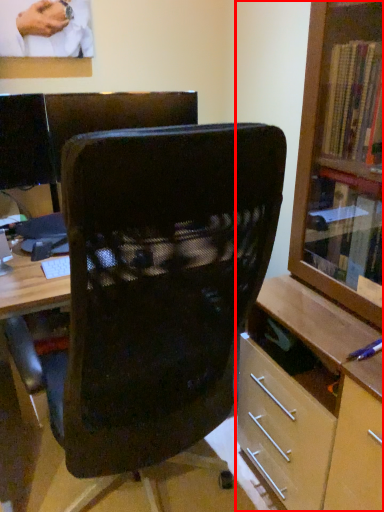
Question: From the image, what is the correct spatial relationship of shelf (annotated by the red box) in relation to chair?

Choices:
 (A) left
 (B) right

Answer: (B)